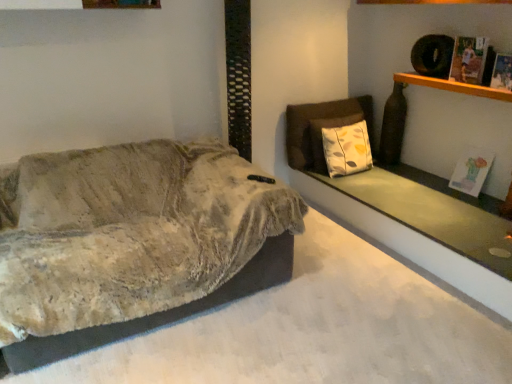
At what (x,y) coordinates should I click in order to perform the action: click on free location above smooth concrete ledge at upper right (from a real-world perspective). Please return your answer as a coordinate pair (x, y). This screenshot has width=512, height=384. Looking at the image, I should click on (434, 201).